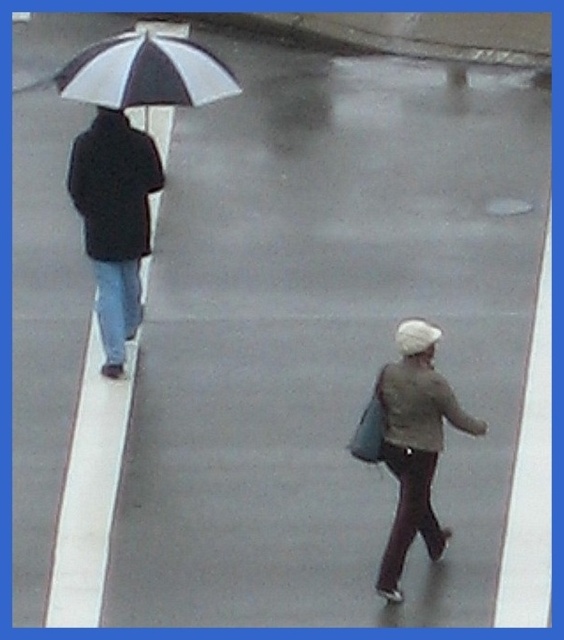
In the scene shown: You are a photographer trying to capture a clear shot of both the light brown fabric jacket at lower right and the white and black striped umbrella at upper left. Given their sizes, which object should you zoom in on first to ensure it fits entirely within the camera frame?

The light brown fabric jacket at lower right is larger in size than the white and black striped umbrella at upper left, so you should zoom in on the light brown fabric jacket at lower right first to ensure it fits entirely within the camera frame.

You are a pedestrian trying to stay dry in the rain. You see a light brown fabric jacket at lower right and a white and black striped umbrella at upper left. Which object is positioned lower in the image?

The light brown fabric jacket at lower right is positioned lower than the white and black striped umbrella at upper left in the image.